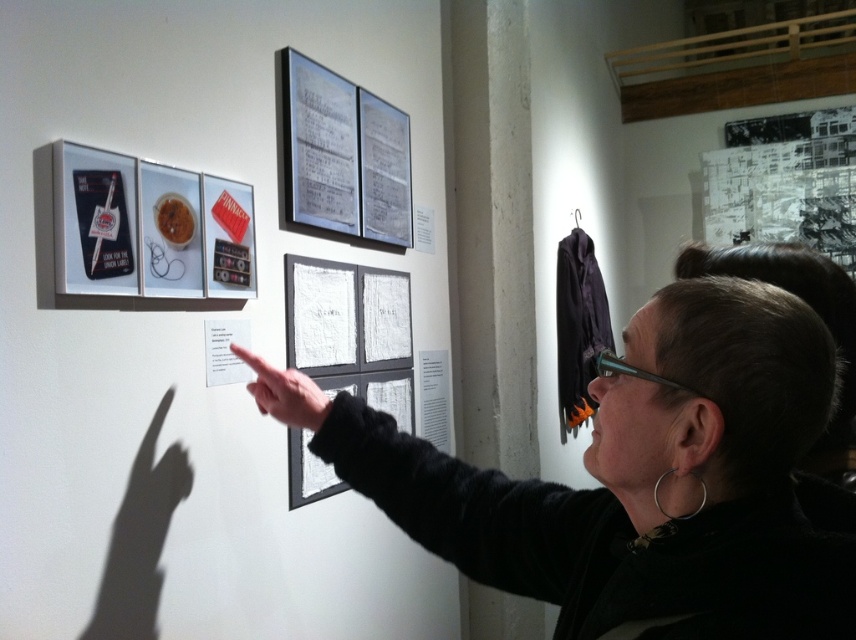
Question: Among these objects, which one is farthest from the camera?

Choices:
 (A) transparent plastic glasses at upper center
 (B) black fabric at center

Answer: (A)

Question: Is black fabric at center to the right of transparent plastic glasses at upper center from the viewer's perspective?

Choices:
 (A) yes
 (B) no

Answer: (B)

Question: Can you confirm if black fabric at center is smaller than transparent plastic glasses at upper center?

Choices:
 (A) no
 (B) yes

Answer: (A)

Question: Is black fabric at center above transparent plastic glasses at upper center?

Choices:
 (A) yes
 (B) no

Answer: (B)

Question: Which point is farther to the camera?

Choices:
 (A) black fabric at center
 (B) transparent plastic glasses at upper center

Answer: (B)